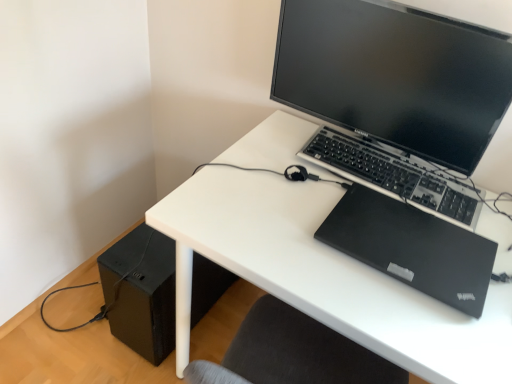
Identify the location of vacant area that lies between black matte laptop at upper right and black plastic keyboard at center. This screenshot has width=512, height=384. (346, 194).